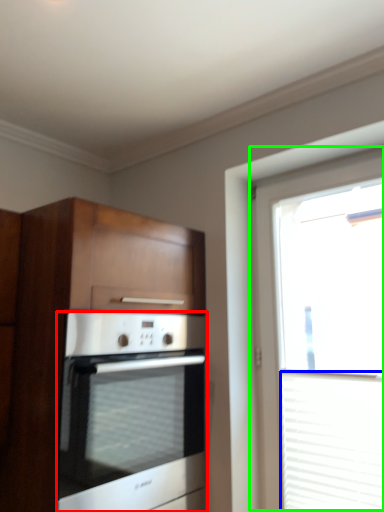
Question: Which is nearer to the oven (highlighted by a red box)? blind (highlighted by a blue box) or window (highlighted by a green box).

Choices:
 (A) blind
 (B) window

Answer: (B)